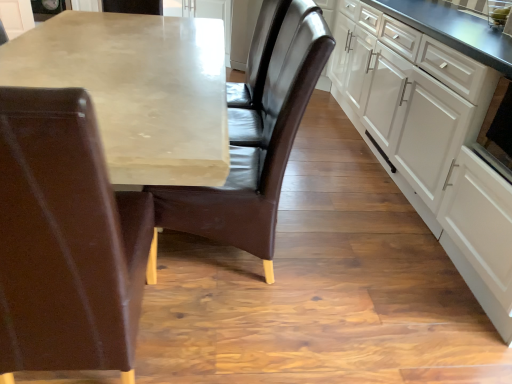
Locate an element on the screen. Image resolution: width=512 pixels, height=384 pixels. vacant area in front of brown leather chair at center, which is counted as the 1th chair, starting from the right is located at coordinates (234, 331).